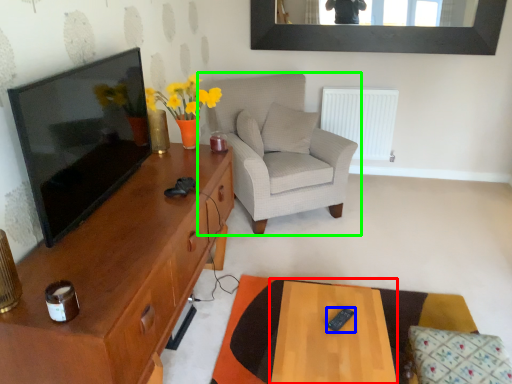
Question: Which object is positioned closest to table (highlighted by a red box)? Select from remote control (highlighted by a blue box) and chair (highlighted by a green box).

Choices:
 (A) remote control
 (B) chair

Answer: (A)